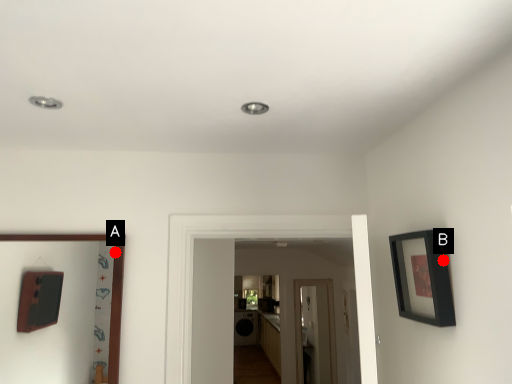
Question: Two points are circled on the image, labeled by A and B beside each circle. Which point is closer to the camera taking this photo?

Choices:
 (A) A is closer
 (B) B is closer

Answer: (B)